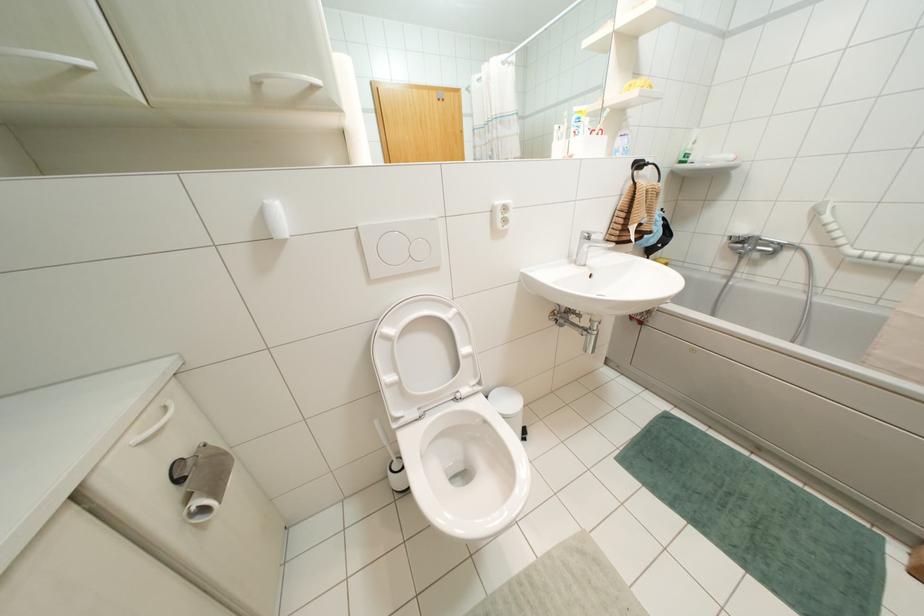
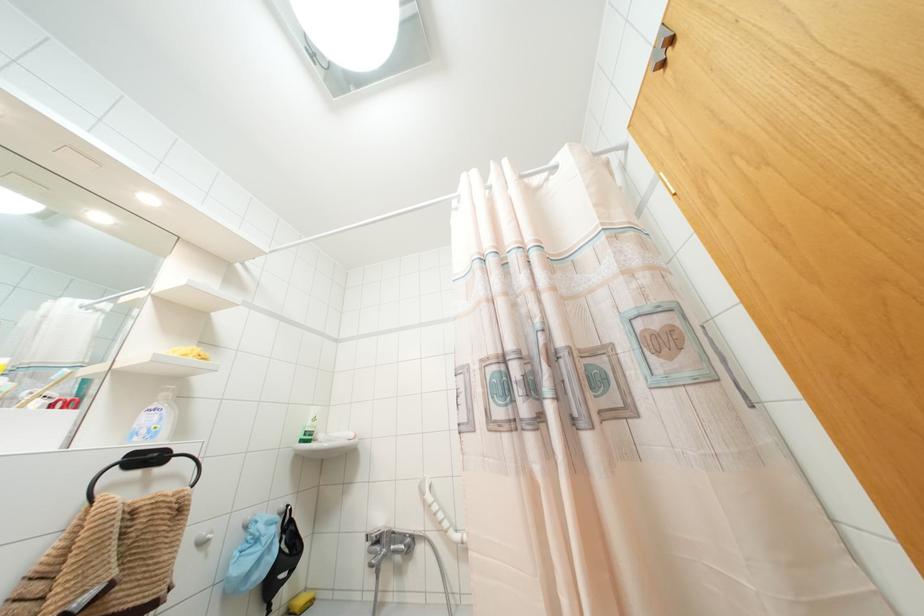
Looking at this image, based on the continuous images, in which direction is the camera rotating?

The rotation direction of the camera is right-up.